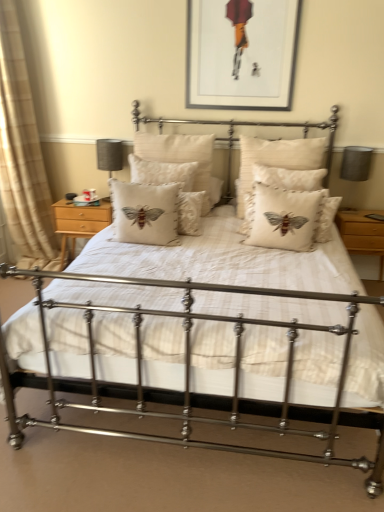
Describe the element at coordinates (276, 159) in the screenshot. I see `creamy linen cushion with embroidered bee at center, marked as the first pillow in a right-to-left arrangement` at that location.

Identify the location of creamy linen cushion with embroidered bee at center, the fourth pillow viewed from the left. (276, 159).

You are a GUI agent. You are given a task and a screenshot of the screen. Output one action in this format:
    pyautogui.click(x=<x>, y=<y>)
    Task: Click on the light wood/finely crafted nightstand at left, which is the 2th nightstand from right to left
    The width and height of the screenshot is (384, 512).
    Given the screenshot: What is the action you would take?
    pyautogui.click(x=79, y=222)

Describe the element at coordinates (362, 233) in the screenshot. I see `wooden nightstand at right, the second nightstand in the left-to-right sequence` at that location.

Where is `matte gray lampshade at left, the second table lamp when ordered from right to left`? Image resolution: width=384 pixels, height=512 pixels. matte gray lampshade at left, the second table lamp when ordered from right to left is located at coordinates (109, 155).

What is the approximate width of beige linen cushion with embroidered moth at center, the second pillow from the left?

The width of beige linen cushion with embroidered moth at center, the second pillow from the left, is 13.14 inches.

Locate an element on the screen. beige cotton cushion with embroidered bee at center, positioned as the first pillow in left-to-right order is located at coordinates (145, 213).

The width and height of the screenshot is (384, 512). In order to click on creamy linen cushion with embroidered bee at center, the fourth pillow viewed from the left in this screenshot , I will do `click(276, 159)`.

Does point (155, 208) appear closer or farther from the camera than point (9, 211)?

Clearly, point (155, 208) is closer to the camera than point (9, 211).

Which object is closer to the camera, beige cotton cushion with embroidered bee at center, which is the fourth pillow in right-to-left order, or beige fabric curtain at left?

beige cotton cushion with embroidered bee at center, which is the fourth pillow in right-to-left order.

Is beige cotton cushion with embroidered bee at center, positioned as the first pillow in left-to-right order, at the left side of beige fabric curtain at left?

Incorrect, beige cotton cushion with embroidered bee at center, positioned as the first pillow in left-to-right order, is not on the left side of beige fabric curtain at left.

From the image's perspective, which one is positioned lower, beige cotton cushion with embroidered bee at center, which is the fourth pillow in right-to-left order, or beige fabric curtain at left?

beige cotton cushion with embroidered bee at center, which is the fourth pillow in right-to-left order, appears lower in the image.

Would you say beige linen cushion with embroidered moth at center, the third pillow in the right-to-left sequence, contains matte black picture frame at upper center?

No, beige linen cushion with embroidered moth at center, the third pillow in the right-to-left sequence, does not contain matte black picture frame at upper center.

Is beige linen cushion with embroidered moth at center, the third pillow in the right-to-left sequence, taller than matte black picture frame at upper center?

In fact, beige linen cushion with embroidered moth at center, the third pillow in the right-to-left sequence, may be shorter than matte black picture frame at upper center.

Is beige linen cushion with embroidered moth at center, the second pillow from the left, not near matte black picture frame at upper center?

No, there isn't a large distance between beige linen cushion with embroidered moth at center, the second pillow from the left, and matte black picture frame at upper center.

Is point (194, 183) positioned in front of point (221, 65)?

Yes, it is in front of point (221, 65).

Is beige embroidered cushion at center, positioned as the third pillow in left-to-right order, oriented towards wooden nightstand at right, the first nightstand when ordered from right to left?

No, beige embroidered cushion at center, positioned as the third pillow in left-to-right order, does not turn towards wooden nightstand at right, the first nightstand when ordered from right to left.

Is beige embroidered cushion at center, positioned as the third pillow in left-to-right order, not inside wooden nightstand at right, the second nightstand in the left-to-right sequence?

beige embroidered cushion at center, positioned as the third pillow in left-to-right order, is positioned outside wooden nightstand at right, the second nightstand in the left-to-right sequence.

Does beige embroidered cushion at center, which ranks as the second pillow in right-to-left order, have a lesser width compared to wooden nightstand at right, the first nightstand when ordered from right to left?

Correct, the width of beige embroidered cushion at center, which ranks as the second pillow in right-to-left order, is less than that of wooden nightstand at right, the first nightstand when ordered from right to left.

Could you tell me if wooden nightstand at right, the first nightstand when ordered from right to left, is turned towards matte black picture frame at upper center?

No, wooden nightstand at right, the first nightstand when ordered from right to left, is not oriented towards matte black picture frame at upper center.

Are wooden nightstand at right, the first nightstand when ordered from right to left, and matte black picture frame at upper center located far from each other?

That's right, there is a large distance between wooden nightstand at right, the first nightstand when ordered from right to left, and matte black picture frame at upper center.

In terms of height, does wooden nightstand at right, the second nightstand in the left-to-right sequence, look taller or shorter compared to matte black picture frame at upper center?

Considering their sizes, wooden nightstand at right, the second nightstand in the left-to-right sequence, has less height than matte black picture frame at upper center.

Is matte gray lampshade at left, the second table lamp when ordered from right to left, further to the viewer compared to matte black picture frame at upper center?

Yes, it is.

Is matte gray lampshade at left, the second table lamp when ordered from right to left, oriented away from matte black picture frame at upper center?

matte gray lampshade at left, the second table lamp when ordered from right to left, does not have its back to matte black picture frame at upper center.

From the picture: Which is correct: matte gray lampshade at left, positioned as the first table lamp in left-to-right order, is inside matte black picture frame at upper center, or outside of it?

matte gray lampshade at left, positioned as the first table lamp in left-to-right order, is spatially situated outside matte black picture frame at upper center.

From a real-world perspective, is light wood/finely crafted nightstand at left, arranged as the first nightstand when viewed from the left, physically located above or below matte gray lampshade at right, the second table lamp positioned from the left?

From a real-world perspective, light wood/finely crafted nightstand at left, arranged as the first nightstand when viewed from the left, is physically below matte gray lampshade at right, the second table lamp positioned from the left.

Is light wood/finely crafted nightstand at left, which is the 2th nightstand from right to left, to the left or to the right of matte gray lampshade at right, the 1th table lamp in the right-to-left sequence, in the image?

In the image, light wood/finely crafted nightstand at left, which is the 2th nightstand from right to left, appears on the left side of matte gray lampshade at right, the 1th table lamp in the right-to-left sequence.

Is matte gray lampshade at right, the 1th table lamp in the right-to-left sequence, at the back of light wood/finely crafted nightstand at left, which is the 2th nightstand from right to left?

That's right, light wood/finely crafted nightstand at left, which is the 2th nightstand from right to left, is facing away from matte gray lampshade at right, the 1th table lamp in the right-to-left sequence.

Could you tell me if light wood/finely crafted nightstand at left, which is the 2th nightstand from right to left, is turned towards beige linen cushion with embroidered moth at center, the second pillow from the left?

No, light wood/finely crafted nightstand at left, which is the 2th nightstand from right to left, is not turned towards beige linen cushion with embroidered moth at center, the second pillow from the left.

Is light wood/finely crafted nightstand at left, arranged as the first nightstand when viewed from the left, next to beige linen cushion with embroidered moth at center, the second pillow from the left?

No, light wood/finely crafted nightstand at left, arranged as the first nightstand when viewed from the left, is not beside beige linen cushion with embroidered moth at center, the second pillow from the left.

In the image, is light wood/finely crafted nightstand at left, which is the 2th nightstand from right to left, on the left side or the right side of beige linen cushion with embroidered moth at center, the second pillow from the left?

Based on their positions, light wood/finely crafted nightstand at left, which is the 2th nightstand from right to left, is located to the left of beige linen cushion with embroidered moth at center, the second pillow from the left.

Does point (62, 241) come behind point (154, 142)?

Yes, it is.

From a real-world perspective, count 3rd pillows downward from the beige fabric curtain at left and point to it. Please provide its 2D coordinates.

[(145, 213)]

The width and height of the screenshot is (384, 512). There is a beige linen cushion with embroidered moth at center, the second pillow from the left. In order to click on picture frame above it (from a real-world perspective) in this screenshot , I will do `click(241, 53)`.

Consider the image. Considering their positions, is light wood/finely crafted nightstand at left, arranged as the first nightstand when viewed from the left, positioned closer to matte gray lampshade at left, positioned as the first table lamp in left-to-right order, than wooden nightstand at right, the second nightstand in the left-to-right sequence?

Among the two, light wood/finely crafted nightstand at left, arranged as the first nightstand when viewed from the left, is located nearer to matte gray lampshade at left, positioned as the first table lamp in left-to-right order.

Estimate the real-world distances between objects in this image. Which object is further from matte gray lampshade at right, the 1th table lamp in the right-to-left sequence, beige linen cushion with embroidered moth at center, the second pillow from the left, or creamy linen cushion with embroidered bee at center, marked as the first pillow in a right-to-left arrangement?

Among the two, beige linen cushion with embroidered moth at center, the second pillow from the left, is located further to matte gray lampshade at right, the 1th table lamp in the right-to-left sequence.

When comparing their distances from wooden nightstand at right, the second nightstand in the left-to-right sequence, does matte gray lampshade at left, the second table lamp when ordered from right to left, or creamy linen cushion with embroidered bee at center, marked as the first pillow in a right-to-left arrangement, seem closer?

Among the two, creamy linen cushion with embroidered bee at center, marked as the first pillow in a right-to-left arrangement, is located nearer to wooden nightstand at right, the second nightstand in the left-to-right sequence.

Which object lies nearer to the anchor point matte gray lampshade at right, the second table lamp positioned from the left, beige embroidered cushion at center, positioned as the third pillow in left-to-right order, or wooden nightstand at right, the first nightstand when ordered from right to left?

wooden nightstand at right, the first nightstand when ordered from right to left, lies closer to matte gray lampshade at right, the second table lamp positioned from the left, than the other object.

Estimate the real-world distances between objects in this image. Which object is closer to beige linen cushion with embroidered moth at center, the third pillow in the right-to-left sequence, wooden nightstand at right, the first nightstand when ordered from right to left, or beige cotton cushion with embroidered bee at center, positioned as the first pillow in left-to-right order?

Based on the image, beige cotton cushion with embroidered bee at center, positioned as the first pillow in left-to-right order, appears to be nearer to beige linen cushion with embroidered moth at center, the third pillow in the right-to-left sequence.

Which object lies further to the anchor point beige linen cushion with embroidered moth at center, the third pillow in the right-to-left sequence, beige embroidered cushion at center, positioned as the third pillow in left-to-right order, or matte gray lampshade at right, the second table lamp positioned from the left?

The object further to beige linen cushion with embroidered moth at center, the third pillow in the right-to-left sequence, is matte gray lampshade at right, the second table lamp positioned from the left.

Looking at the image, which one is located closer to matte black picture frame at upper center, matte gray lampshade at right, the second table lamp positioned from the left, or beige fabric curtain at left?

matte gray lampshade at right, the second table lamp positioned from the left, is closer to matte black picture frame at upper center.

Looking at the image, which one is located further to creamy linen cushion with embroidered bee at center, marked as the first pillow in a right-to-left arrangement, beige fabric curtain at left or beige cotton cushion with embroidered bee at center, which is the fourth pillow in right-to-left order?

beige fabric curtain at left.

The image size is (384, 512). I want to click on picture frame between light wood/finely crafted nightstand at left, which is the 2th nightstand from right to left, and matte gray lampshade at right, the second table lamp positioned from the left, from left to right, so click(x=241, y=53).

This screenshot has width=384, height=512. What are the coordinates of `picture frame located between beige fabric curtain at left and beige embroidered cushion at center, which ranks as the second pillow in right-to-left order, in the left-right direction` in the screenshot? It's located at (241, 53).

Locate an element on the screen. The width and height of the screenshot is (384, 512). pillow located between beige embroidered cushion at center, which ranks as the second pillow in right-to-left order, and wooden nightstand at right, the first nightstand when ordered from right to left, in the left-right direction is located at coordinates (276, 159).

The image size is (384, 512). In order to click on nightstand located between beige fabric curtain at left and creamy linen cushion with embroidered bee at center, the fourth pillow viewed from the left, in the left-right direction in this screenshot , I will do tap(79, 222).